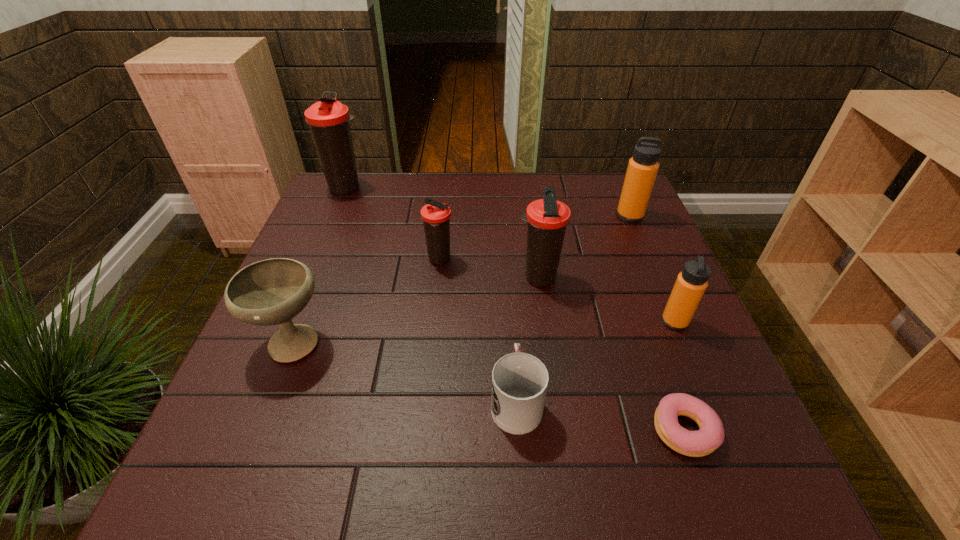
Where is `the leftmost brown thermos bottle`? the leftmost brown thermos bottle is located at coordinates (328, 119).

This screenshot has height=540, width=960. I want to click on the farthest brown thermos bottle, so click(x=328, y=119).

Where is `the rightmost brown thermos bottle`? The image size is (960, 540). the rightmost brown thermos bottle is located at coordinates (547, 218).

What are the coordinates of `the third thermos bottle from right to left` in the screenshot? It's located at (547, 218).

Where is `the farther orange thermos bottle`? The image size is (960, 540). the farther orange thermos bottle is located at coordinates (642, 169).

Locate an element on the screen. the seventh nearest object is located at coordinates (642, 169).

The height and width of the screenshot is (540, 960). Identify the location of the sixth object from right to left. (436, 216).

In order to click on the second thermos bottle from left to right in this screenshot , I will do `click(436, 216)`.

Find the location of a particular element. Image resolution: width=960 pixels, height=540 pixels. the nearest thermos bottle is located at coordinates (690, 285).

Locate an element on the screen. the nearer orange thermos bottle is located at coordinates (690, 285).